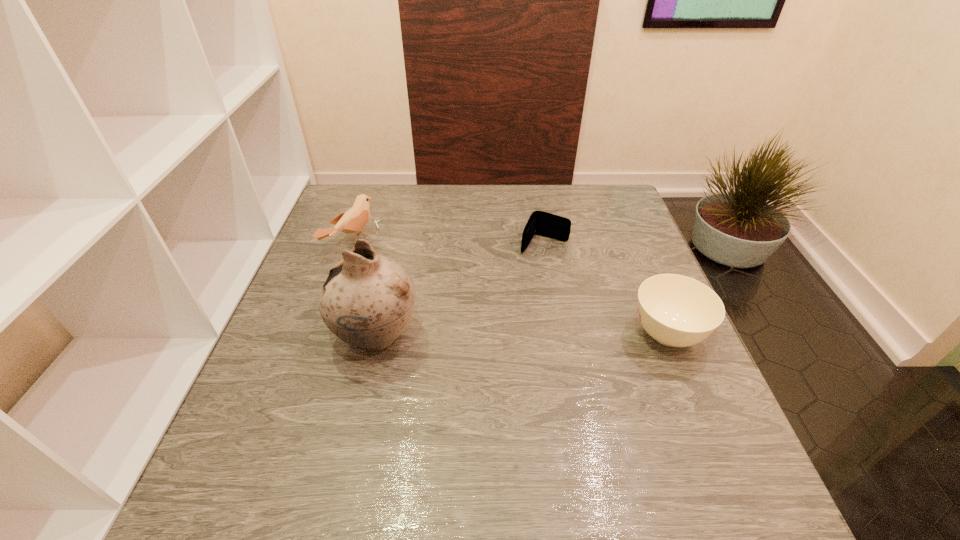
Identify the location of free space on the desktop that is between the tallest object and the rightmost object and is positioned at the beak of the bird. (557, 335).

Find the location of `vacant space on the desktop that is between the tallest object and the sugar bowl and is positioned on the outer surface of the wallet`. vacant space on the desktop that is between the tallest object and the sugar bowl and is positioned on the outer surface of the wallet is located at coordinates (496, 335).